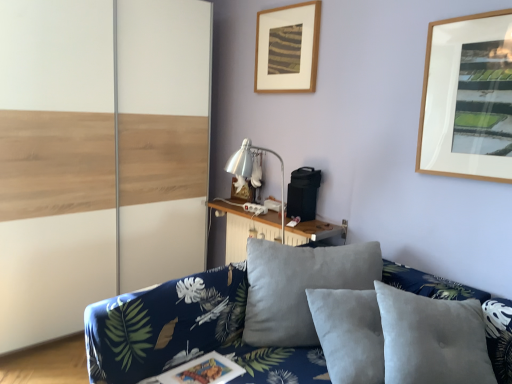
Question: Which direction should I rotate to look at wooden picture frame at upper center, which is the second picture frame in right-to-left order, — up or down?

Choices:
 (A) down
 (B) up

Answer: (B)

Question: Is wooden table at center positioned with its back to wooden picture frame at upper center, which ranks as the 1th picture frame in bottom-to-top order?

Choices:
 (A) yes
 (B) no

Answer: (B)

Question: Can you confirm if wooden table at center is thinner than wooden picture frame at upper center, which is the second picture frame in right-to-left order?

Choices:
 (A) no
 (B) yes

Answer: (A)

Question: Considering the relative sizes of wooden table at center and wooden picture frame at upper center, the 1th picture frame viewed from the left, in the image provided, is wooden table at center wider than wooden picture frame at upper center, the 1th picture frame viewed from the left,?

Choices:
 (A) yes
 (B) no

Answer: (A)

Question: Does wooden table at center turn towards wooden picture frame at upper center, arranged as the second picture frame when viewed from the front?

Choices:
 (A) no
 (B) yes

Answer: (A)

Question: From a real-world perspective, is wooden table at center physically below wooden picture frame at upper center, arranged as the second picture frame when viewed from the front?

Choices:
 (A) yes
 (B) no

Answer: (A)

Question: From the image's perspective, is wooden table at center located beneath wooden picture frame at upper center, acting as the first picture frame starting from the back?

Choices:
 (A) no
 (B) yes

Answer: (B)

Question: Is white wood barn door at left aimed at wooden table at center?

Choices:
 (A) yes
 (B) no

Answer: (A)

Question: Considering the relative sizes of white wood barn door at left and wooden table at center in the image provided, is white wood barn door at left taller than wooden table at center?

Choices:
 (A) yes
 (B) no

Answer: (A)

Question: Is white wood barn door at left not near wooden table at center?

Choices:
 (A) yes
 (B) no

Answer: (B)

Question: Considering the relative sizes of white wood barn door at left and wooden table at center in the image provided, is white wood barn door at left thinner than wooden table at center?

Choices:
 (A) yes
 (B) no

Answer: (B)

Question: From the image's perspective, is white wood barn door at left on top of wooden table at center?

Choices:
 (A) no
 (B) yes

Answer: (B)

Question: From a real-world perspective, is white wood barn door at left positioned under wooden table at center based on gravity?

Choices:
 (A) yes
 (B) no

Answer: (B)

Question: Considering the relative positions of wooden picture frame at upper center, acting as the first picture frame starting from the back, and white wood barn door at left in the image provided, is wooden picture frame at upper center, acting as the first picture frame starting from the back, to the right of white wood barn door at left from the viewer's perspective?

Choices:
 (A) no
 (B) yes

Answer: (B)